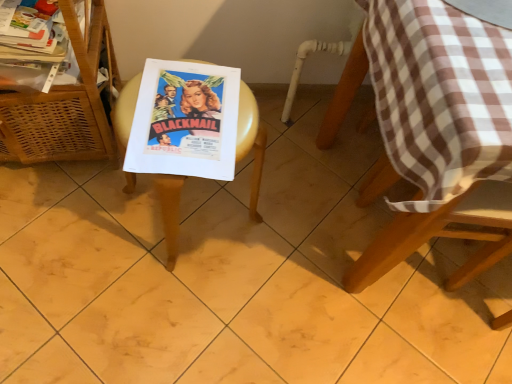
Question: Is wooden picnic table at center facing away from woven wood basket at left?

Choices:
 (A) yes
 (B) no

Answer: (A)

Question: Is wooden picnic table at center touching woven wood basket at left?

Choices:
 (A) yes
 (B) no

Answer: (B)

Question: From a real-world perspective, is wooden picnic table at center below woven wood basket at left?

Choices:
 (A) yes
 (B) no

Answer: (A)

Question: Is wooden picnic table at center in front of woven wood basket at left?

Choices:
 (A) no
 (B) yes

Answer: (A)

Question: Is wooden picnic table at center outside of woven wood basket at left?

Choices:
 (A) yes
 (B) no

Answer: (A)

Question: Is woven wood basket at left a part of wooden picnic table at center?

Choices:
 (A) no
 (B) yes

Answer: (A)

Question: Does woven wood basket at left have a greater width compared to wooden picnic table at center?

Choices:
 (A) no
 (B) yes

Answer: (B)

Question: Can you see woven wood basket at left touching wooden picnic table at center?

Choices:
 (A) yes
 (B) no

Answer: (B)

Question: Is wooden picnic table at center at the back of woven wood basket at left?

Choices:
 (A) yes
 (B) no

Answer: (B)

Question: Can you confirm if woven wood basket at left is positioned to the left of wooden picnic table at center?

Choices:
 (A) no
 (B) yes

Answer: (B)

Question: Would you consider woven wood basket at left to be distant from wooden picnic table at center?

Choices:
 (A) no
 (B) yes

Answer: (A)

Question: Considering the relative sizes of woven wood basket at left and wooden picnic table at center in the image provided, is woven wood basket at left shorter than wooden picnic table at center?

Choices:
 (A) no
 (B) yes

Answer: (A)

Question: From a real-world perspective, is brown checkered tablecloth at upper right located beneath wooden picnic table at center?

Choices:
 (A) no
 (B) yes

Answer: (A)